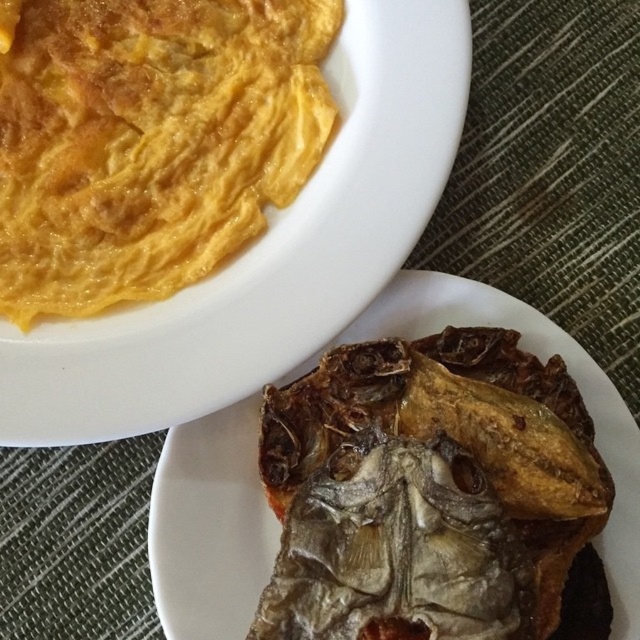
Who is positioned more to the left, brown crispy fish at lower right or yellow soft omelette at upper left?

Positioned to the left is yellow soft omelette at upper left.

Which of these two, brown crispy fish at lower right or yellow soft omelette at upper left, stands taller?

Standing taller between the two is yellow soft omelette at upper left.

Is point (502, 385) positioned before point (291, 12)?

That is True.

This screenshot has width=640, height=640. What are the coordinates of `brown crispy fish at lower right` in the screenshot? It's located at (428, 490).